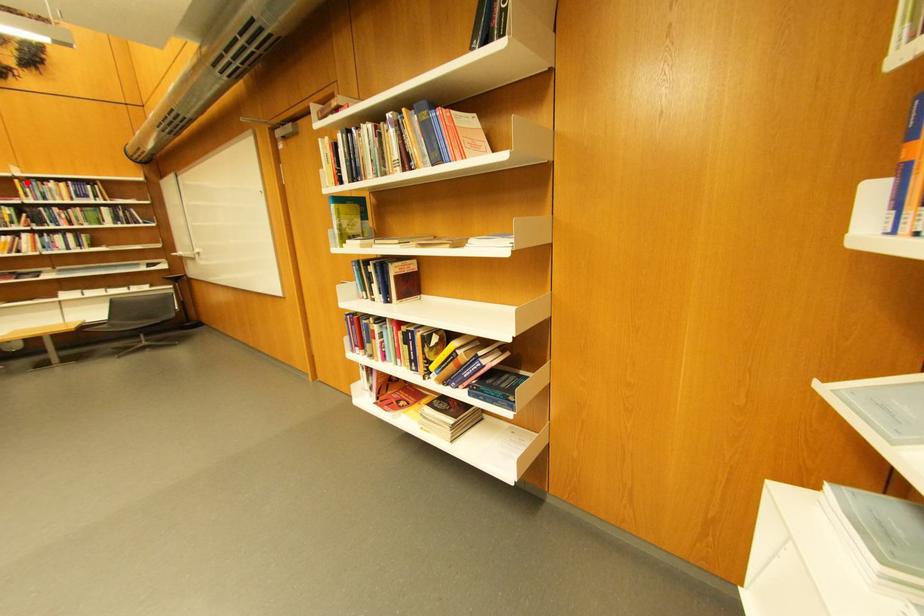
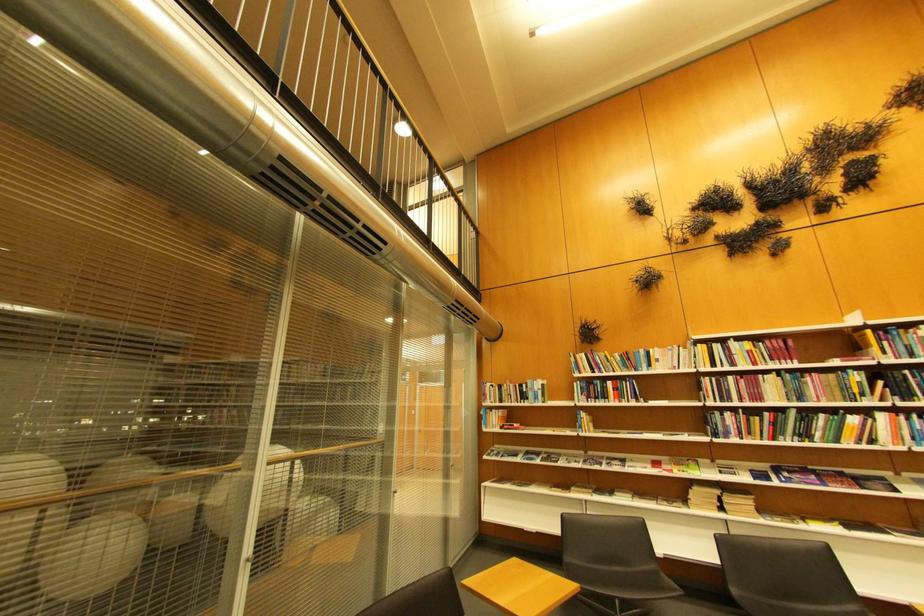
Where in the second image is the point corresponding to the highlighted location from the first image?

(880, 333)